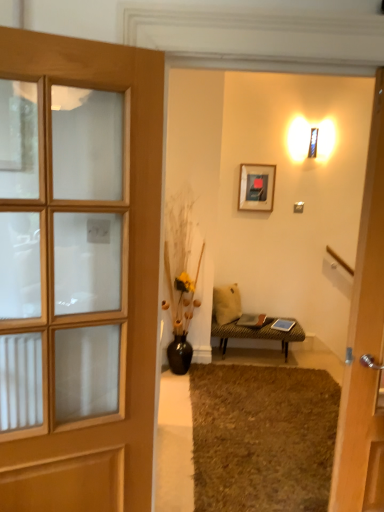
This screenshot has width=384, height=512. I want to click on vacant region above wooden door at left (from a real-world perspective), so click(76, 39).